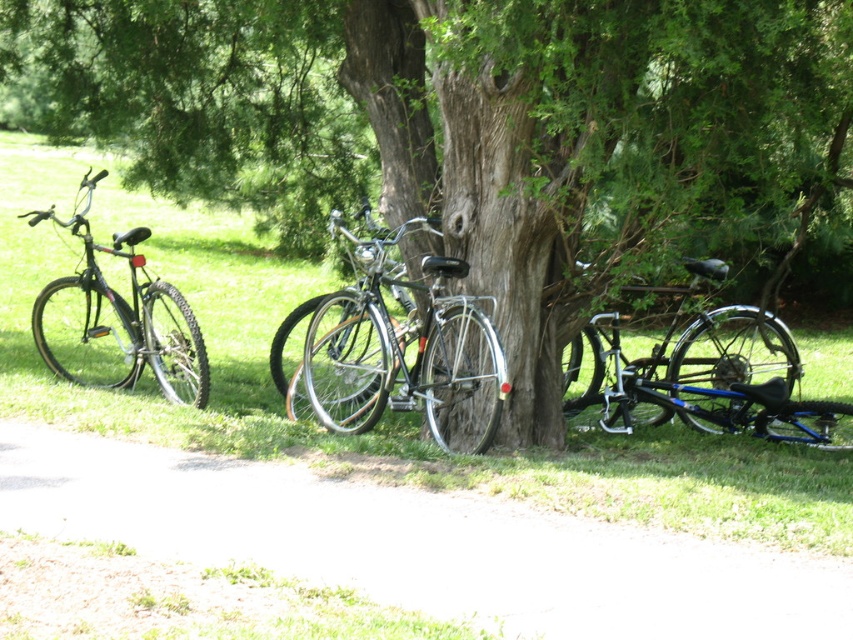
Who is more distant from viewer, (392, 368) or (155, 358)?

The point (155, 358) is more distant.

Measure the distance from shiny silver bicycle at center to matte black bicycle at left.

shiny silver bicycle at center is 1.63 meters from matte black bicycle at left.

Which is in front, point (451, 390) or point (125, 308)?

Point (451, 390) is more forward.

Find the location of a particular element. The height and width of the screenshot is (640, 853). shiny silver bicycle at center is located at coordinates (404, 349).

The image size is (853, 640). Find the location of `blue metallic bicycle at right`. blue metallic bicycle at right is located at coordinates (699, 368).

Can you confirm if blue metallic bicycle at right is wider than matte black bicycle at left?

No.

You are a GUI agent. You are given a task and a screenshot of the screen. Output one action in this format:
    pyautogui.click(x=<x>, y=<y>)
    Task: Click on the blue metallic bicycle at right
    This screenshot has height=640, width=853.
    Given the screenshot: What is the action you would take?
    pyautogui.click(x=699, y=368)

Can you confirm if green textured tree at center is positioned to the left of shiny silver bicycle at center?

Indeed, green textured tree at center is positioned on the left side of shiny silver bicycle at center.

Does green textured tree at center have a lesser height compared to shiny silver bicycle at center?

No.

Where is `green textured tree at center`? green textured tree at center is located at coordinates (473, 131).